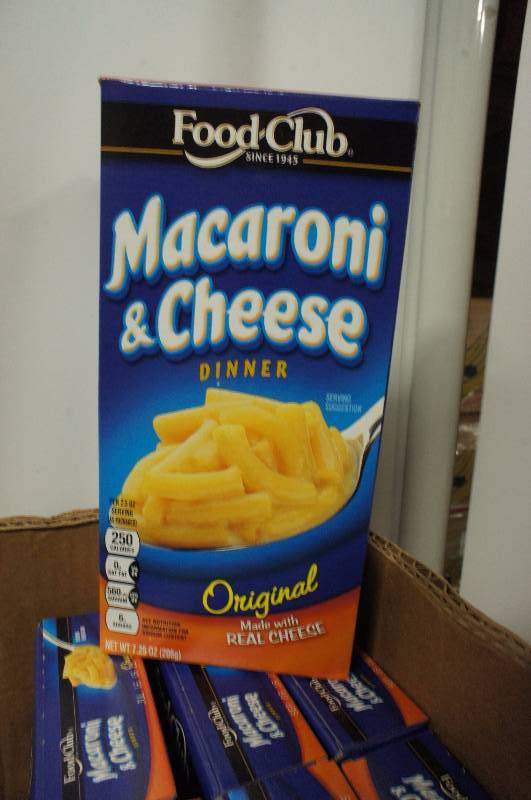
What are the coordinates of `opening in door` in the screenshot? It's located at (483, 249).